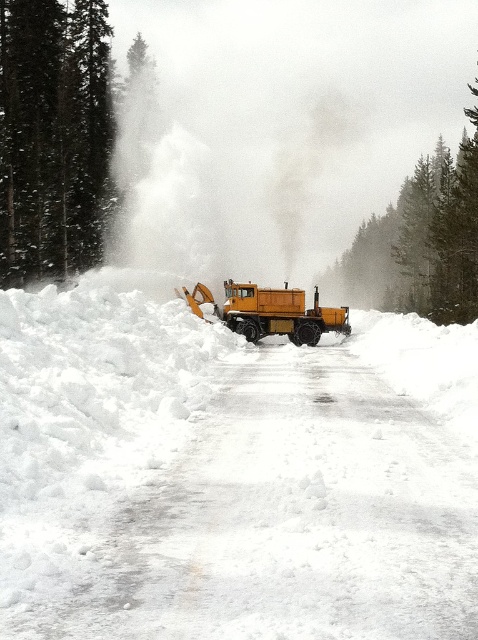
You are a snowplow driver operating a bright yellow orange truck. You need to clear the white fluffy snow at center. Where exactly should you aim your snowplow blade to effectively remove the snow?

You should aim your snowplow blade at point (231, 476) where the white fluffy snow at center is located.

You are a pedestrian trying to cross the road safely. You see the white powdery steam at center and the yellow matte truck at center. Which object is wider, making it harder to judge the road conditions?

The white powdery steam at center might be wider than the yellow matte truck at center, so it could make it harder to judge the road conditions due to its width.